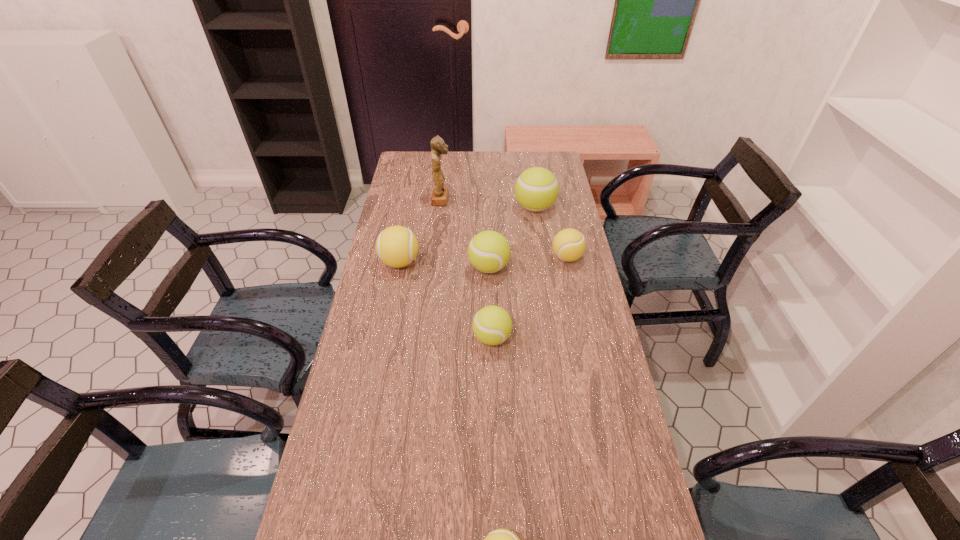
Where is `vacant region that satisfies the following two spatial constraints: 1. on the front side of the second nearest green tennis ball; 2. on the left side of the sixth farthest object`? Image resolution: width=960 pixels, height=540 pixels. vacant region that satisfies the following two spatial constraints: 1. on the front side of the second nearest green tennis ball; 2. on the left side of the sixth farthest object is located at coordinates (491, 338).